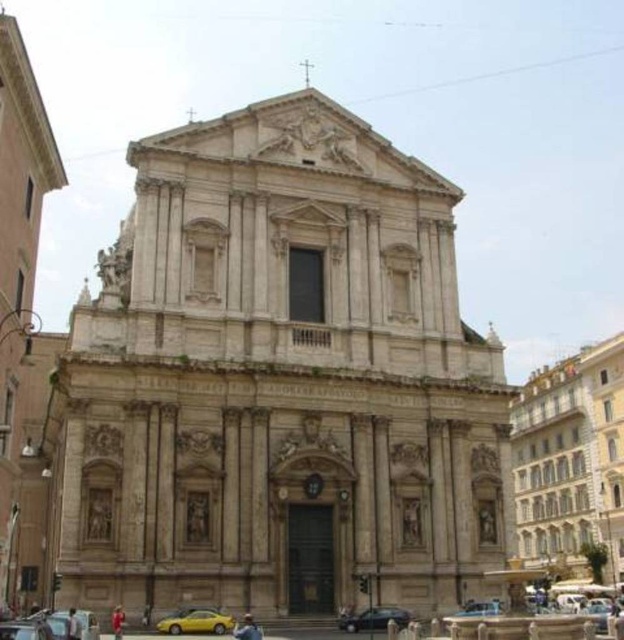
Is shiny black sedan at lower center above silver metallic car at center?

Yes, shiny black sedan at lower center is above silver metallic car at center.

Is shiny black sedan at lower center to the right of silver metallic car at center from the viewer's perspective?

In fact, shiny black sedan at lower center is to the left of silver metallic car at center.

Image resolution: width=624 pixels, height=640 pixels. Identify the location of shiny black sedan at lower center. (373, 620).

Can you confirm if shiny black sedan at lower center is taller than yellow metallic car at lower left?

No, shiny black sedan at lower center is not taller than yellow metallic car at lower left.

Can you confirm if shiny black sedan at lower center is positioned below yellow metallic car at lower left?

Yes, shiny black sedan at lower center is below yellow metallic car at lower left.

This screenshot has height=640, width=624. Find the location of `shiny black sedan at lower center`. shiny black sedan at lower center is located at coordinates (373, 620).

I want to click on shiny black sedan at lower center, so click(x=373, y=620).

Who is taller, beige stone church at center or yellow metallic car at lower left?

Standing taller between the two is beige stone church at center.

Is beige stone church at center bigger than yellow metallic car at lower left?

Yes, beige stone church at center is bigger than yellow metallic car at lower left.

Which is behind, point (142, 154) or point (42, 632)?

Point (142, 154)

At what (x,y) coordinates should I click in order to perform the action: click on beige stone church at center. Please return your answer as a coordinate pair (x, y). The image size is (624, 640). Looking at the image, I should click on (280, 381).